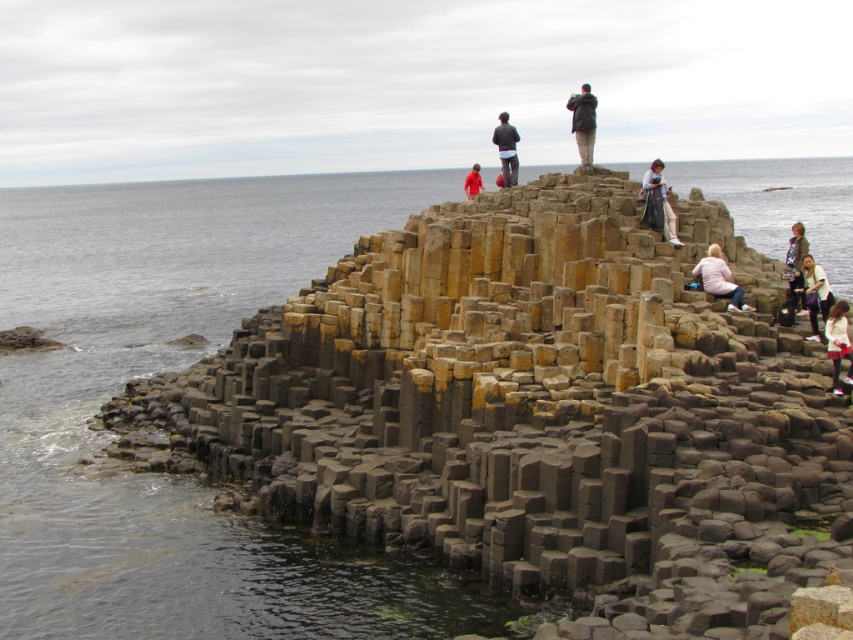
Question: Is white cotton shirt at upper right thinner than light brown leather jacket at upper right?

Choices:
 (A) no
 (B) yes

Answer: (B)

Question: Can you confirm if dark gray hexagonal columns at center is thinner than light brown leather jacket at upper right?

Choices:
 (A) no
 (B) yes

Answer: (B)

Question: Is white cotton jacket at lower right behind dark gray jacket at upper center?

Choices:
 (A) no
 (B) yes

Answer: (A)

Question: Which point is farther to the camera?

Choices:
 (A) dark gray hexagonal columns at center
 (B) white cotton shirt at upper right
 (C) dark blue jacket at upper center

Answer: (C)

Question: Which object is the closest to the dark gray jacket at upper center?

Choices:
 (A) matte gray jacket at upper center
 (B) matte pink sweater at upper right
 (C) dark gray hexagonal columns at center
 (D) white cotton jacket at lower right

Answer: (A)

Question: Which point is farther to the camera?

Choices:
 (A) white cotton jacket at lower right
 (B) dark gray jacket at upper center
 (C) red fabric jacket at center
 (D) dark gray hexagonal columns at center

Answer: (C)